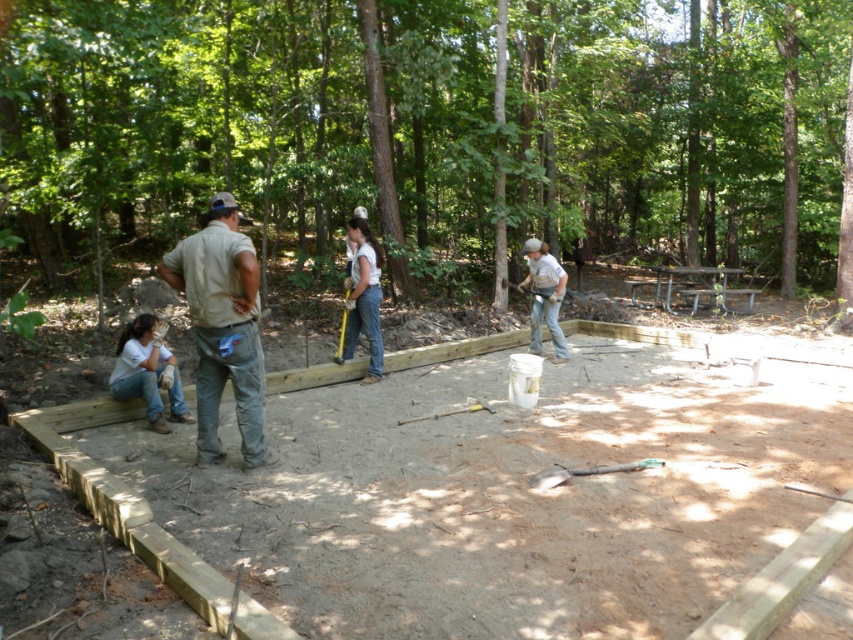
Looking at this image, you are a construction worker standing at the edge of the wooden platform. You need to hand a tool to the person wearing the matte gray shirt at center. Which direction should you walk to reach them first without passing the green plastic shovel at lower center?

The matte gray shirt at center is closer to you than the green plastic shovel at lower center, so you should walk towards the matte gray shirt at center directly since it is nearer and you won

You are a construction worker who needs to determine if the matte gray shirt at center can be placed over the green plastic shovel at lower center without falling off. Based on their sizes, is this possible?

The matte gray shirt at center is larger than the green plastic shovel at lower center, so placing it over the shovel might not be stable and could easily fall off.